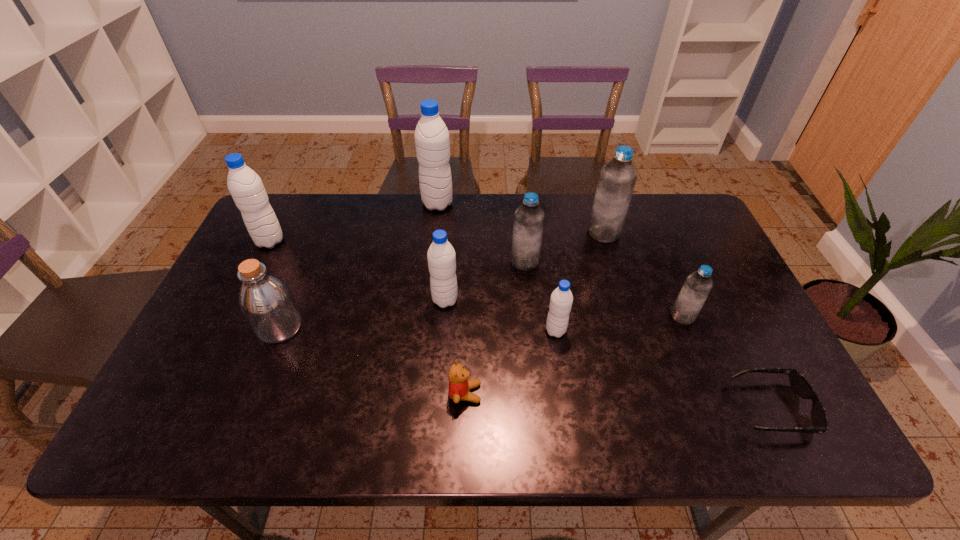
You are a GUI agent. You are given a task and a screenshot of the screen. Output one action in this format:
    pyautogui.click(x=<x>, y=<y>)
    Task: Click on the blank area located on the right of the leftmost gray water bottle
    
    Given the screenshot: What is the action you would take?
    pyautogui.click(x=348, y=241)

At what (x,y) coordinates should I click in order to perform the action: click on free space located on the right of the leftmost blue water bottle. Please return your answer as a coordinate pair (x, y). The image size is (960, 540). Looking at the image, I should click on (582, 262).

Where is `blank area located on the front of the second nearest gray water bottle`? The width and height of the screenshot is (960, 540). blank area located on the front of the second nearest gray water bottle is located at coordinates (435, 435).

This screenshot has width=960, height=540. Find the location of `free space located on the right of the ninth object from right to left`. free space located on the right of the ninth object from right to left is located at coordinates (410, 327).

You are a GUI agent. You are given a task and a screenshot of the screen. Output one action in this format:
    pyautogui.click(x=<x>, y=<y>)
    Task: Click on the vacant region located on the left of the second object from right to left
    
    Given the screenshot: What is the action you would take?
    pyautogui.click(x=596, y=316)

Where is `free location located on the front of the smallest gray water bottle`? The image size is (960, 540). free location located on the front of the smallest gray water bottle is located at coordinates (563, 377).

The width and height of the screenshot is (960, 540). I want to click on vacant space located on the front-facing side of the red teddy bear, so click(593, 393).

Locate an element on the screen. The height and width of the screenshot is (540, 960). free spot located 0.060m on the front-facing side of the black sunglasses is located at coordinates (710, 407).

Locate an element on the screen. This screenshot has height=540, width=960. blank area located on the front-facing side of the black sunglasses is located at coordinates (675, 407).

Find the location of a particular element. vacant space located on the front-facing side of the black sunglasses is located at coordinates (604, 407).